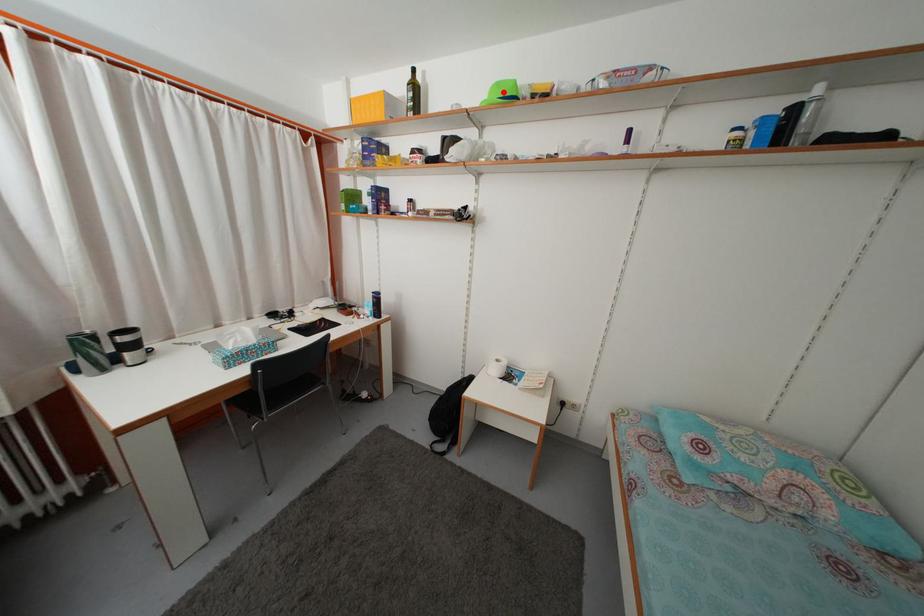
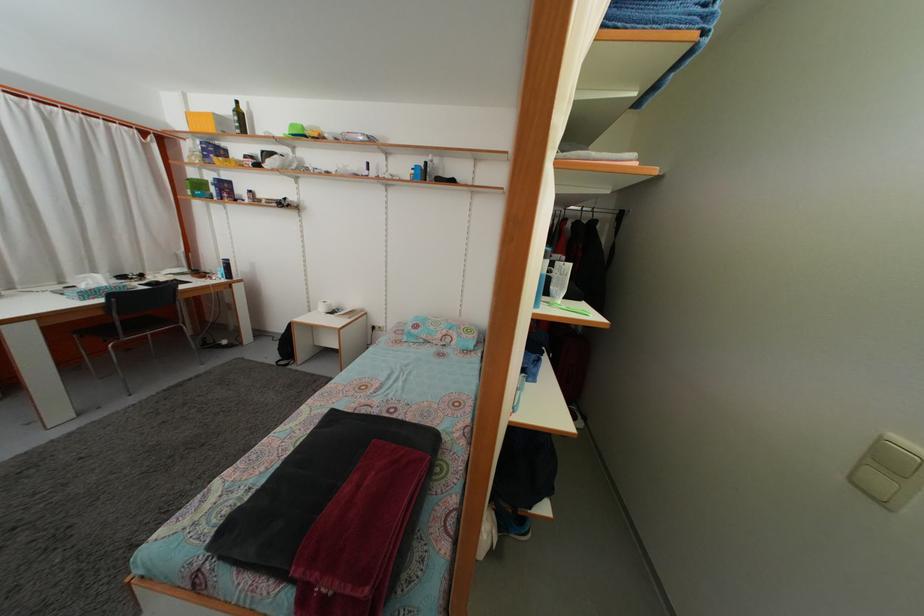
The point at the highlighted location is marked in the first image. Where is the corresponding point in the second image?

(298, 132)